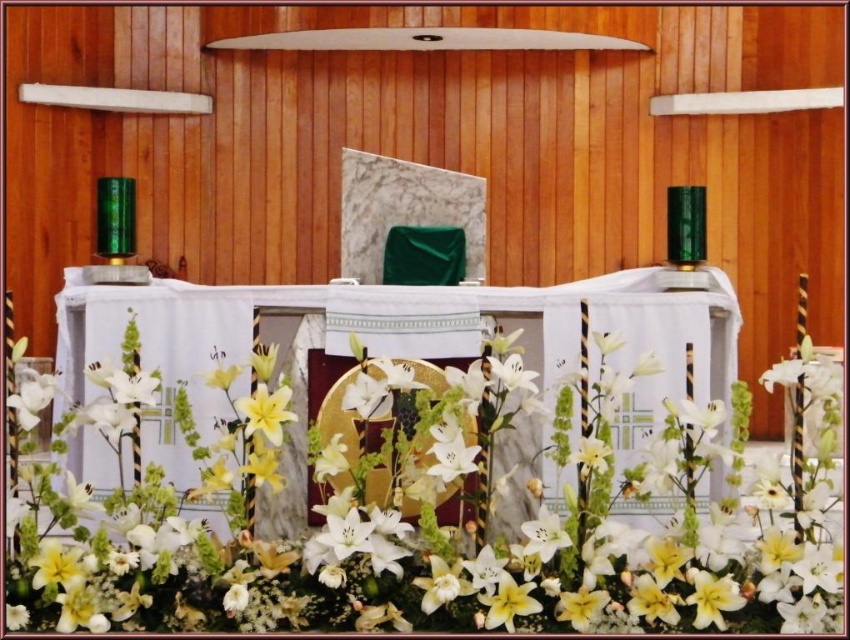
You are standing in front of the altar and want to take a closer look at the white lilies at center. If you walk forward 2 meters, will you be able to touch them?

The white lilies at center are 2.53 meters away from the camera. After walking forward 2 meters, you would be 0.53 meters away from them, so you can reach and touch them.

You are an interior designer planning to add a new centerpiece to the altar. The current altar has the white lilies at center and the white fabric altar at center. Which object has a greater width?

The white lilies at center have a greater width than the white fabric altar at center.

You are standing in front of the altar and want to place a small candle on the altar. The candle requires a space that is at least 10 feet away from the white lilies at center to avoid fire hazards. Is the current distance sufficient?

The distance between you and the white lilies at center is 8.31 feet, which is less than the required 10 feet. Therefore, the current distance is not sufficient to safely place the candle.